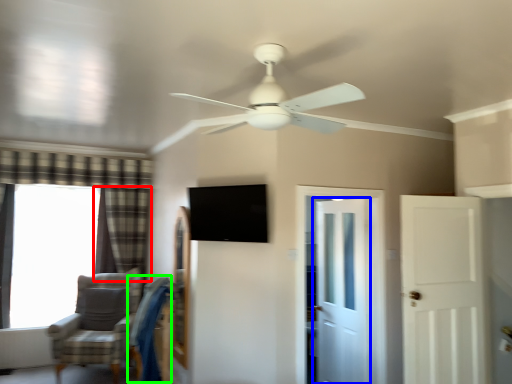
Question: Which is farther away from curtain (highlighted by a red box)? door (highlighted by a blue box) or swivel chair (highlighted by a green box)?

Choices:
 (A) door
 (B) swivel chair

Answer: (A)